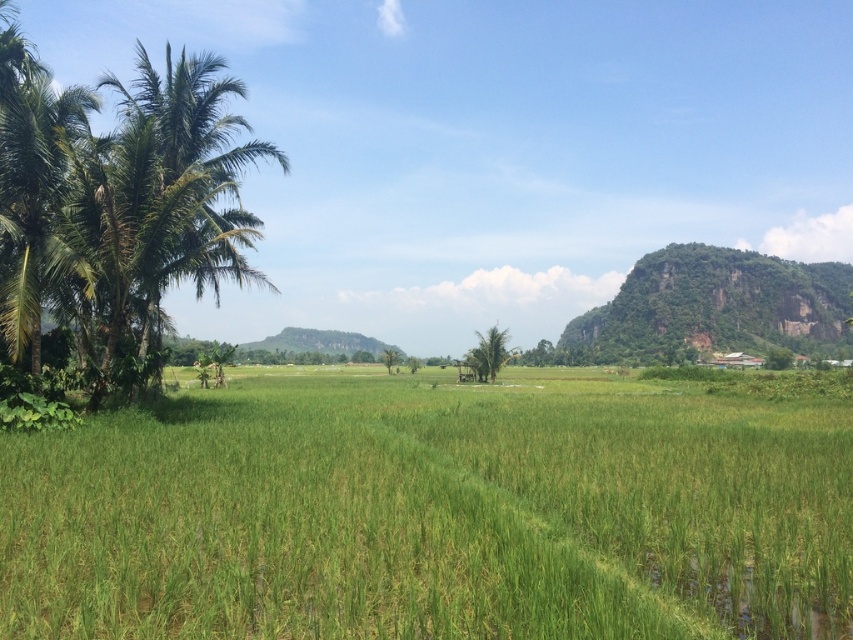
You are a farmer planning to plant a new row of trees between the green leafy coconut tree at left and the green leafy palm tree at center. Which tree should you use as a reference for the desired height of your new trees?

The green leafy coconut tree at left has a greater height compared to the green leafy palm tree at center, so you should use the coconut tree as the reference for the desired height of your new trees.

You are planning to plant a new tree in your backyard. You have two options based on the image you see. The first option is the green leafy coconut tree at left, and the second is the green rocky mountain at right. Which of these two would be taller if you were to plant them in your garden?

The green leafy coconut tree at left is taller than the green rocky mountain at right according to the image description.